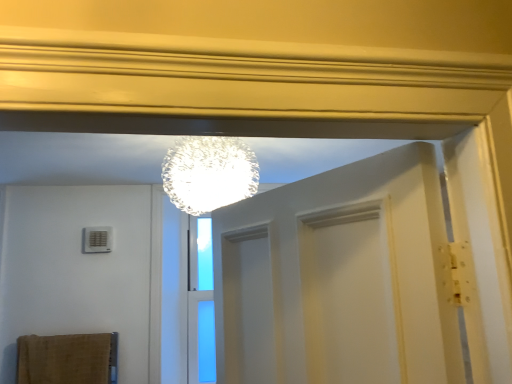
Question: Looking at their shapes, would you say transparent glass sphere at upper center is wider or thinner than burlap bath towel at lower left?

Choices:
 (A) wide
 (B) thin

Answer: (A)

Question: Does point (163, 173) appear closer or farther from the camera than point (64, 339)?

Choices:
 (A) closer
 (B) farther

Answer: (A)

Question: Considering the relative positions of transparent glass sphere at upper center and burlap bath towel at lower left in the image provided, is transparent glass sphere at upper center to the left or to the right of burlap bath towel at lower left?

Choices:
 (A) right
 (B) left

Answer: (A)

Question: Is burlap bath towel at lower left situated inside transparent glass sphere at upper center or outside?

Choices:
 (A) outside
 (B) inside

Answer: (A)

Question: Considering the positions of point (91, 354) and point (199, 147), is point (91, 354) closer or farther from the camera than point (199, 147)?

Choices:
 (A) closer
 (B) farther

Answer: (B)

Question: Considering the positions of burlap bath towel at lower left and transparent glass sphere at upper center in the image, is burlap bath towel at lower left wider or thinner than transparent glass sphere at upper center?

Choices:
 (A) wide
 (B) thin

Answer: (B)

Question: From the image's perspective, is burlap bath towel at lower left located above or below transparent glass sphere at upper center?

Choices:
 (A) above
 (B) below

Answer: (B)